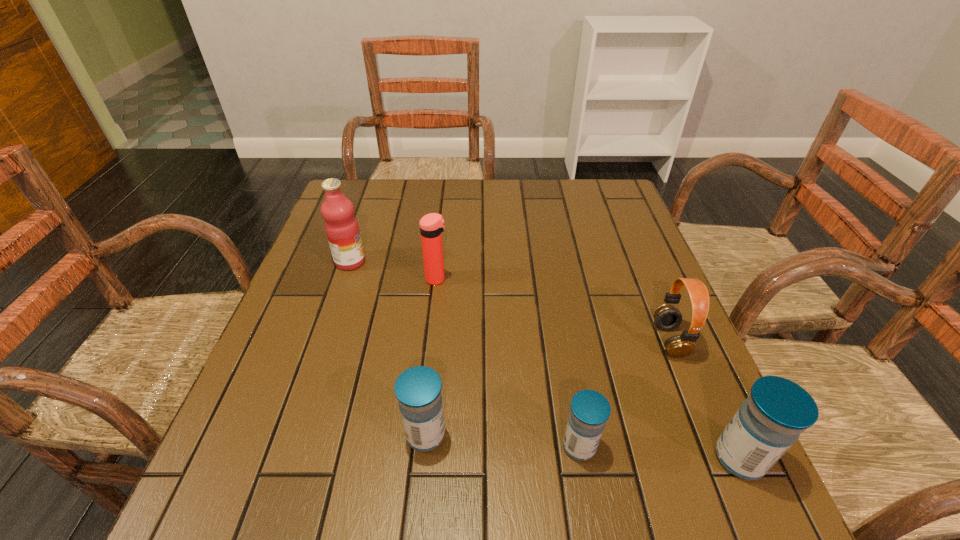
You are a GUI agent. You are given a task and a screenshot of the screen. Output one action in this format:
    pyautogui.click(x=<x>, y=<y>)
    Task: Click on the free space located on the back of the rightmost medicine
    
    Given the screenshot: What is the action you would take?
    pyautogui.click(x=694, y=358)

Find the location of a particular element. This screenshot has height=540, width=960. vacant space located 0.050m on the ear cups of the fourth nearest object is located at coordinates (634, 340).

You are a GUI agent. You are given a task and a screenshot of the screen. Output one action in this format:
    pyautogui.click(x=<x>, y=<y>)
    Task: Click on the vacant space located 0.400m on the ear cups of the fourth nearest object
    
    Given the screenshot: What is the action you would take?
    pyautogui.click(x=470, y=340)

The width and height of the screenshot is (960, 540). Find the location of `vacant position located 0.280m on the ear cups of the fourth nearest object`. vacant position located 0.280m on the ear cups of the fourth nearest object is located at coordinates (526, 340).

Image resolution: width=960 pixels, height=540 pixels. I want to click on vacant space located on the right of the thermos bottle, so click(x=598, y=279).

Identify the location of vacant region located on the label of the tallest object. The image size is (960, 540). (450, 262).

Locate an element on the screen. The width and height of the screenshot is (960, 540). object that is at the left edge is located at coordinates (341, 226).

This screenshot has height=540, width=960. What are the coordinates of `medicine at the right edge` in the screenshot? It's located at (777, 410).

Find the location of a particular element. The width and height of the screenshot is (960, 540). headset that is at the right edge is located at coordinates (667, 317).

Locate an element on the screen. The width and height of the screenshot is (960, 540). object situated at the near right corner is located at coordinates (777, 410).